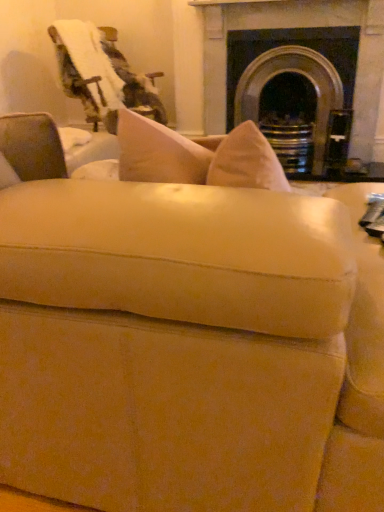
Question: Should I look upward or downward to see dark gray stone fireplace at upper center?

Choices:
 (A) down
 (B) up

Answer: (B)

Question: Should I look upward or downward to see velvet-like swivel chair at upper left?

Choices:
 (A) down
 (B) up

Answer: (B)

Question: Considering the relative sizes of dark gray stone fireplace at upper center and velvet-like swivel chair at upper left in the image provided, is dark gray stone fireplace at upper center shorter than velvet-like swivel chair at upper left?

Choices:
 (A) no
 (B) yes

Answer: (A)

Question: From the image's perspective, is dark gray stone fireplace at upper center over velvet-like swivel chair at upper left?

Choices:
 (A) no
 (B) yes

Answer: (B)

Question: From a real-world perspective, is dark gray stone fireplace at upper center located beneath velvet-like swivel chair at upper left?

Choices:
 (A) no
 (B) yes

Answer: (B)

Question: Would you say dark gray stone fireplace at upper center is outside velvet-like swivel chair at upper left?

Choices:
 (A) yes
 (B) no

Answer: (A)

Question: Does dark gray stone fireplace at upper center have a greater width compared to velvet-like swivel chair at upper left?

Choices:
 (A) no
 (B) yes

Answer: (A)

Question: From a real-world perspective, is dark gray stone fireplace at upper center located higher than velvet-like swivel chair at upper left?

Choices:
 (A) yes
 (B) no

Answer: (B)

Question: From the image's perspective, is velvet-like swivel chair at upper left located beneath dark gray stone fireplace at upper center?

Choices:
 (A) yes
 (B) no

Answer: (A)

Question: Is velvet-like swivel chair at upper left wider than dark gray stone fireplace at upper center?

Choices:
 (A) yes
 (B) no

Answer: (A)

Question: Is dark gray stone fireplace at upper center at the back of velvet-like swivel chair at upper left?

Choices:
 (A) no
 (B) yes

Answer: (A)

Question: Is the surface of velvet-like swivel chair at upper left in direct contact with dark gray stone fireplace at upper center?

Choices:
 (A) no
 (B) yes

Answer: (A)

Question: Is velvet-like swivel chair at upper left positioned far away from dark gray stone fireplace at upper center?

Choices:
 (A) yes
 (B) no

Answer: (B)

Question: From a real-world perspective, is velvet-like swivel chair at upper left on dark gray stone fireplace at upper center?

Choices:
 (A) no
 (B) yes

Answer: (B)

Question: Considering the positions of point click(x=205, y=120) and point click(x=71, y=23), is point click(x=205, y=120) closer or farther from the camera than point click(x=71, y=23)?

Choices:
 (A) farther
 (B) closer

Answer: (A)